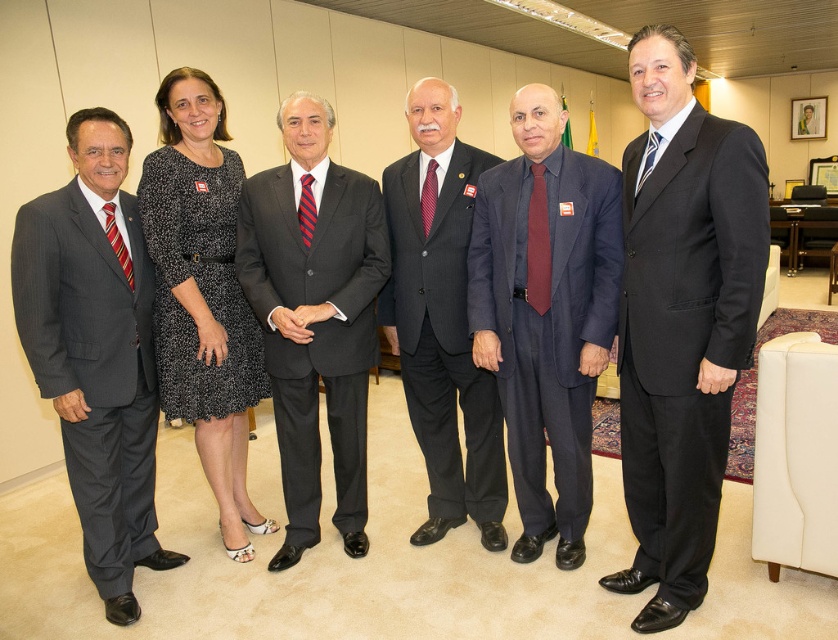
Question: Can you confirm if black textured dress at center is bigger than dark gray suit at center?

Choices:
 (A) yes
 (B) no

Answer: (B)

Question: Which object appears closest to the camera in this image?

Choices:
 (A) maroon silk tie at center
 (B) dark gray suit at center
 (C) red striped tie at center

Answer: (A)

Question: From the image, what is the correct spatial relationship of black suit at right in relation to dark gray suit at center?

Choices:
 (A) above
 (B) below

Answer: (A)

Question: Among these points, which one is nearest to the camera?

Choices:
 (A) (411, 362)
 (B) (309, 195)

Answer: (B)

Question: Is black textured dress at center bigger than red striped tie at center?

Choices:
 (A) no
 (B) yes

Answer: (B)

Question: Which is nearer to the navy blue suit at center?

Choices:
 (A) black textured dress at center
 (B) matte black suit at left

Answer: (A)